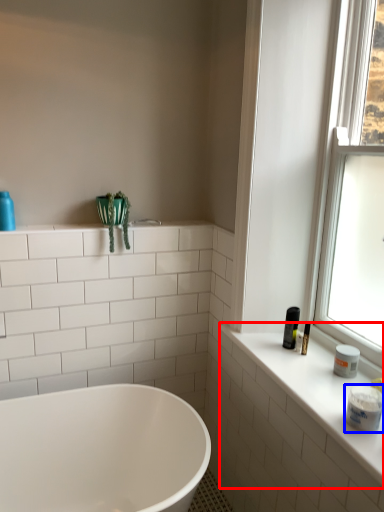
Question: Which point is closer to the camera, counter top (highlighted by a red box) or toiletry (highlighted by a blue box)?

Choices:
 (A) counter top
 (B) toiletry

Answer: (A)